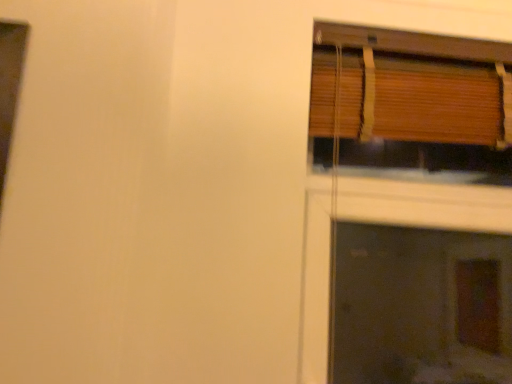
Question: Is wooden blinds at upper right wider than wooden blinds at upper right?

Choices:
 (A) yes
 (B) no

Answer: (A)

Question: Can you confirm if wooden blinds at upper right is bigger than wooden blinds at upper right?

Choices:
 (A) yes
 (B) no

Answer: (A)

Question: Is wooden blinds at upper right not close to wooden blinds at upper right?

Choices:
 (A) no
 (B) yes

Answer: (B)

Question: Is wooden blinds at upper right completely or partially outside of wooden blinds at upper right?

Choices:
 (A) yes
 (B) no

Answer: (A)

Question: From the image's perspective, would you say wooden blinds at upper right is shown under wooden blinds at upper right?

Choices:
 (A) no
 (B) yes

Answer: (B)

Question: Can you confirm if wooden blinds at upper right is thinner than wooden blinds at upper right?

Choices:
 (A) yes
 (B) no

Answer: (B)

Question: Can you confirm if wooden blinds at upper right is wider than wooden blinds at upper right?

Choices:
 (A) no
 (B) yes

Answer: (A)

Question: Is wooden blinds at upper right bigger than wooden blinds at upper right?

Choices:
 (A) yes
 (B) no

Answer: (B)

Question: From a real-world perspective, does wooden blinds at upper right sit lower than wooden blinds at upper right?

Choices:
 (A) no
 (B) yes

Answer: (A)

Question: Would you say wooden blinds at upper right is part of wooden blinds at upper right's contents?

Choices:
 (A) no
 (B) yes

Answer: (A)

Question: From a real-world perspective, is wooden blinds at upper right over wooden blinds at upper right?

Choices:
 (A) no
 (B) yes

Answer: (B)

Question: Is wooden blinds at upper right in front of wooden blinds at upper right?

Choices:
 (A) yes
 (B) no

Answer: (A)

Question: Is wooden blinds at upper right bigger or smaller than wooden blinds at upper right?

Choices:
 (A) small
 (B) big

Answer: (A)